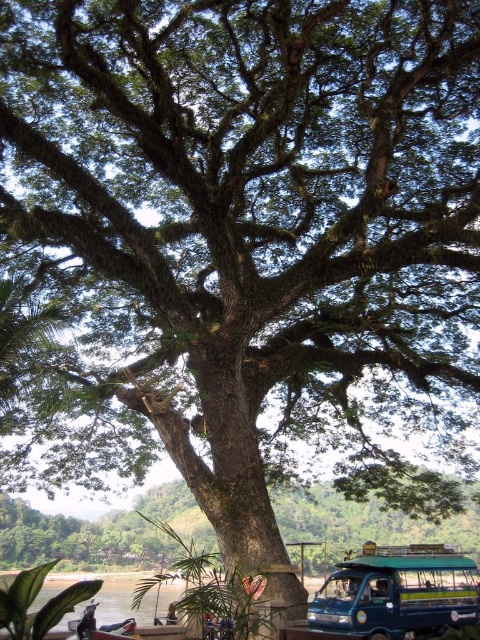
From the picture: You are standing at the base of the green rough bark tree at center and want to see the blue metallic van at lower right. In which direction should you look to see the van?

The blue metallic van at lower right is above the green rough bark tree at center, so you should look upward to see the van.

You are standing at the edge of the riverbank and want to walk to the blue metallic van at lower right. Which direction should you head relative to the green rough bark tree at center?

You should head to the right of the green rough bark tree at center to reach the blue metallic van at lower right since the tree is located to the left of the van.

You are a photographer planning to take a wide shot of the green rough bark tree at center and the blue metallic van at lower right. Based on their sizes, which object should you focus on first to ensure it fits entirely in the frame?

The green rough bark tree at center is bigger than the blue metallic van at lower right, so you should focus on ensuring the green rough bark tree at center fits first, as it requires more space in the frame.